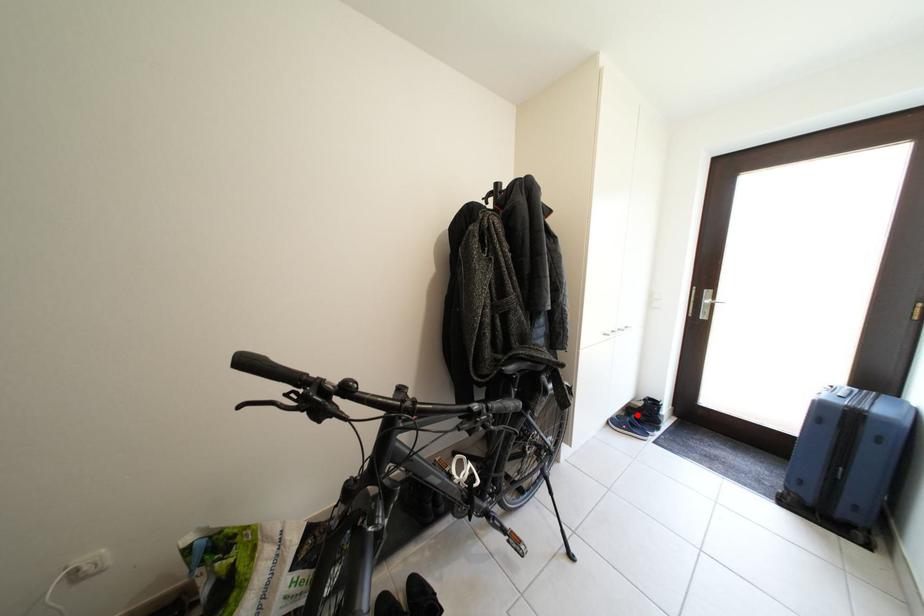
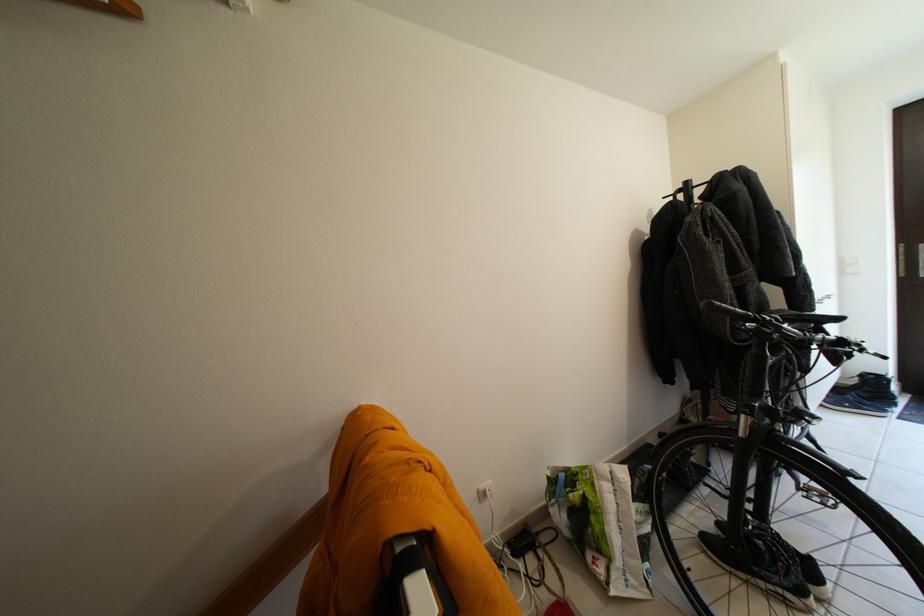
Question: A red point is marked in image1. In image2, is the corresponding 3D point closer to the camera or farther? Reply with the corresponding letter.

Choices:
 (A) The corresponding 3D point is closer.
 (B) The corresponding 3D point is farther.

Answer: (A)